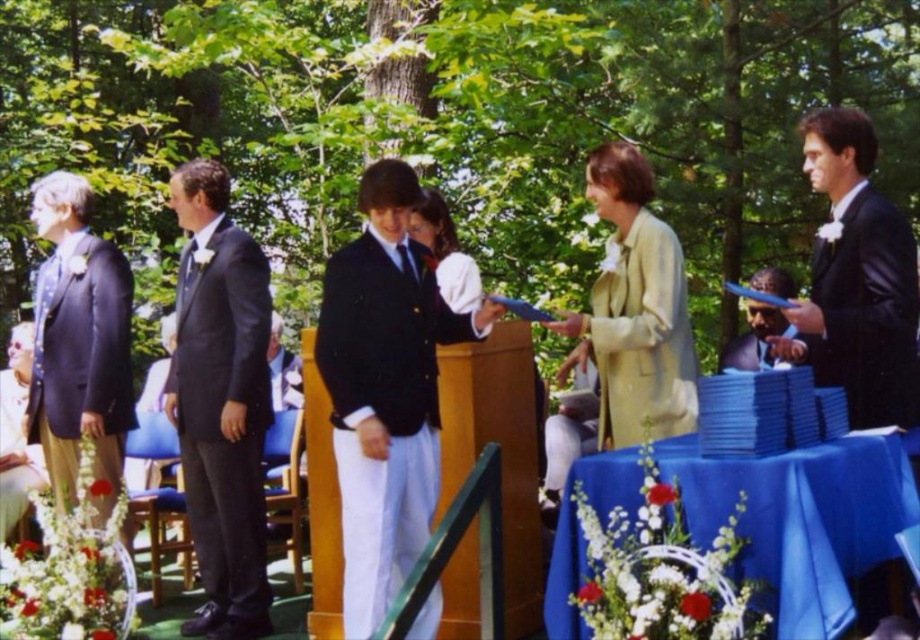
Question: Considering the real-world distances, which object is closest to the matte black suit at center?

Choices:
 (A) shiny black blazer at center
 (B) matte black suit at left
 (C) light beige fabric dress at lower left

Answer: (A)

Question: Is matte black suit at left positioned behind matte black suit at center?

Choices:
 (A) no
 (B) yes

Answer: (A)

Question: Which point is farther from the camera taking this photo?

Choices:
 (A) (238, 504)
 (B) (769, 352)

Answer: (B)

Question: Based on their relative distances, which object is nearer to the matte black suit at left?

Choices:
 (A) black satin suit at left
 (B) light beige fabric dress at lower left
 (C) black leather suit at right
 (D) matte black suit at center

Answer: (A)

Question: Can you confirm if shiny black blazer at center is smaller than black satin suit at left?

Choices:
 (A) no
 (B) yes

Answer: (B)

Question: Does light beige fabric dress at lower left have a larger size compared to matte black suit at center?

Choices:
 (A) no
 (B) yes

Answer: (B)